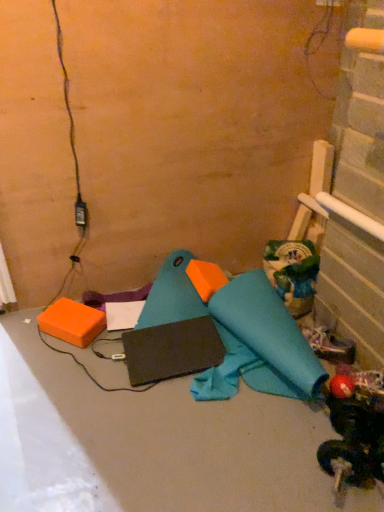
Where is `vacant space situated above matte black laptop at center (from a real-world perspective)`? vacant space situated above matte black laptop at center (from a real-world perspective) is located at coordinates (169, 407).